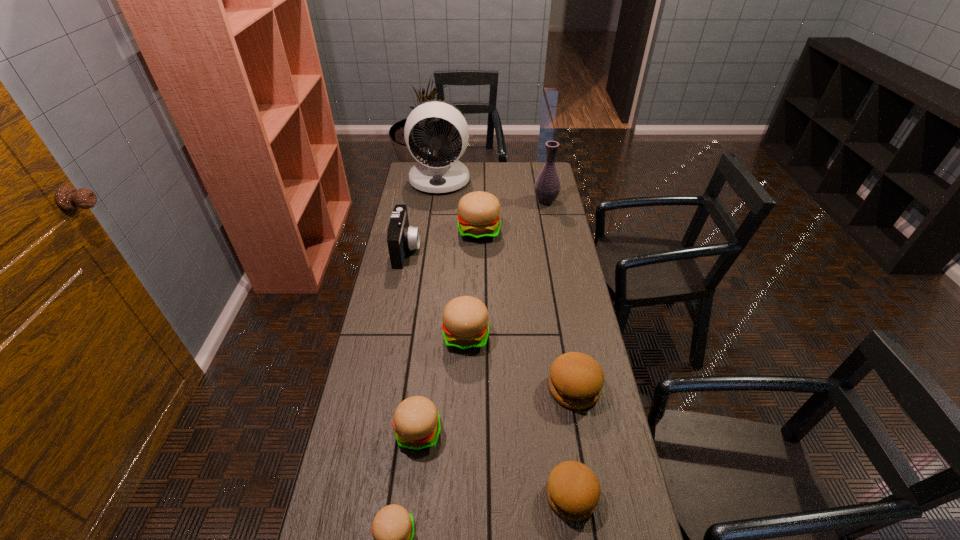
At what (x,y) coordinates should I click in order to perform the action: click on free region located 0.150m on the back of the nearer brown hamburger. Please return your answer as a coordinate pair (x, y). Image resolution: width=960 pixels, height=540 pixels. Looking at the image, I should click on (560, 419).

Find the location of `object at the far edge`. object at the far edge is located at coordinates (442, 173).

You are a GUI agent. You are given a task and a screenshot of the screen. Output one action in this format:
    pyautogui.click(x=<x>, y=<y>)
    Task: Click on the fan that is at the left edge
    The width and height of the screenshot is (960, 540).
    Given the screenshot: What is the action you would take?
    pyautogui.click(x=442, y=173)

Where is `camcorder that is at the left edge`? camcorder that is at the left edge is located at coordinates (401, 237).

At what (x,y) coordinates should I click in order to perform the action: click on hamburger situated at the left edge. Please return your answer as a coordinate pair (x, y). The image size is (960, 540). Looking at the image, I should click on (416, 421).

I want to click on vase present at the right edge, so click(x=547, y=186).

You are a GUI agent. You are given a task and a screenshot of the screen. Output one action in this format:
    pyautogui.click(x=<x>, y=<y>)
    Task: Click on the object situated at the far left corner
    Image resolution: width=960 pixels, height=540 pixels.
    Given the screenshot: What is the action you would take?
    tap(442, 173)

Locate an element on the screen. Image resolution: width=960 pixels, height=540 pixels. free space at the far edge of the desktop is located at coordinates (509, 184).

Where is `free space at the left edge`? free space at the left edge is located at coordinates (394, 282).

In the image, there is a desktop. At what (x,y) coordinates should I click in order to perform the action: click on free space at the right edge. Please return your answer as a coordinate pair (x, y). The height and width of the screenshot is (540, 960). Looking at the image, I should click on (561, 327).